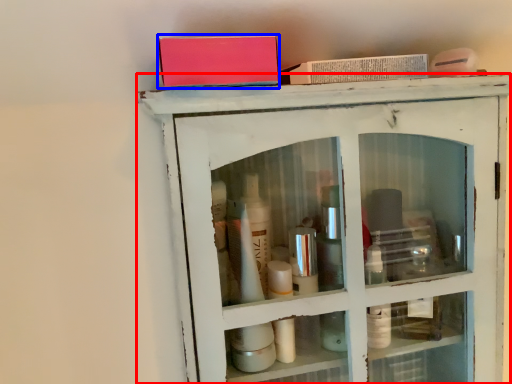
Question: Which object is closer to the camera taking this photo, shelf (highlighted by a red box) or book (highlighted by a blue box)?

Choices:
 (A) shelf
 (B) book

Answer: (B)